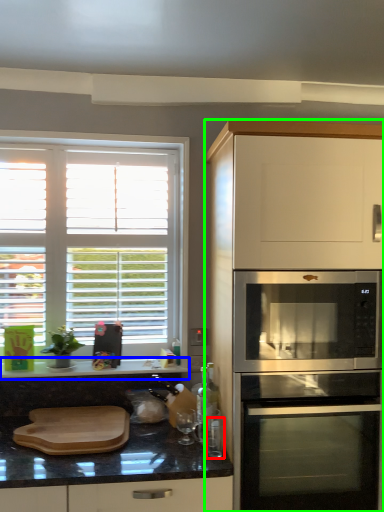
Question: Which object is the farthest from appliance (highlighted by a red box)? Choose among these: countertop (highlighted by a blue box) or cabinetry (highlighted by a green box).

Choices:
 (A) countertop
 (B) cabinetry

Answer: (A)